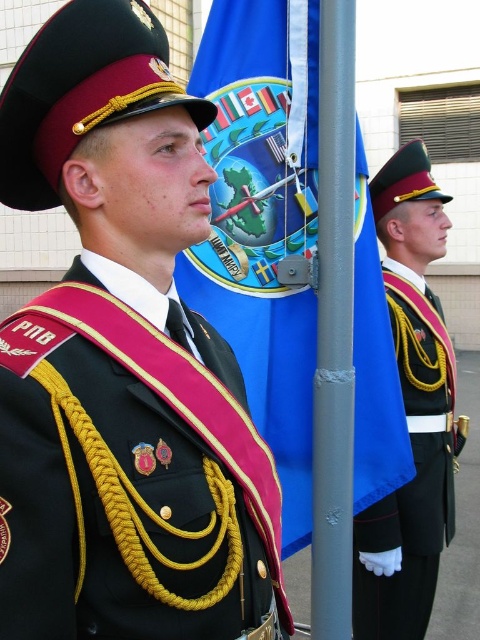
Based on the photo, you are a photographer trying to capture a photo of the black satin sash at center and the blue fabric flag at center. The camera can only focus on objects within a 30 inch range. Will both objects be in focus?

Answer: The black satin sash at center and blue fabric flag at center are 34.65 inches apart from each other, which exceeds the camera focus range of 30 inches. Therefore, both objects cannot be in focus simultaneously.

You are a military photographer tasked with capturing a photo of the black satin sash at center and the blue fabric flag at center. You need to ensure that both objects are clearly visible in the frame. Given their sizes, which object might require you to adjust your camera angle to avoid being too small in the photo?

The black satin sash at center has a smaller width compared to the blue fabric flag at center, so it might require adjusting the camera angle to ensure it is not too small in the photo.